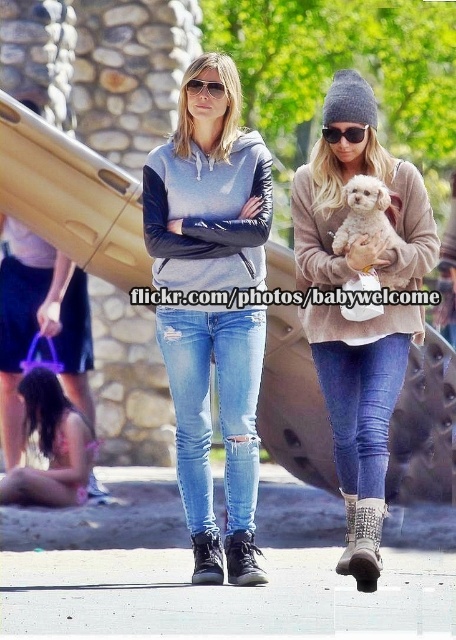
In the scene shown: You are standing in the park and want to take a photo of both the slide and the two people. The slide is on the left side of the image. You have two points marked on your camera screen to focus on. Point A is at coordinates point [321,230] and Point B is at coordinates point [367,129]. Which point should you focus on to ensure the closer object is in focus?

Point A at coordinates point [321,230] is closer to the viewer than point [367,129], so focusing on Point A will ensure the closer object is in focus.

You are a photographer trying to capture both the matte gray hoodie at center and the light pink fabric bikini at lower left in the same frame. However, your camera can only focus on one subject at a time. Which object should you focus on first to ensure the other remains in the background?

You should focus on the matte gray hoodie at center first because it is in front of the light pink fabric bikini at lower left, so the bikini will naturally appear in the background when the hoodie is in focus.

You are a photographer trying to capture the knit gray beanie at upper right located at point (362, 412) in the image. The photographer is standing at the center of the image. Which direction should you move to get closer to the knit gray beanie at upper right?

The knit gray beanie at upper right is located at point (362, 412). Since the photographer is at the center, moving towards the upper right direction will bring them closer to the knit gray beanie at upper right.